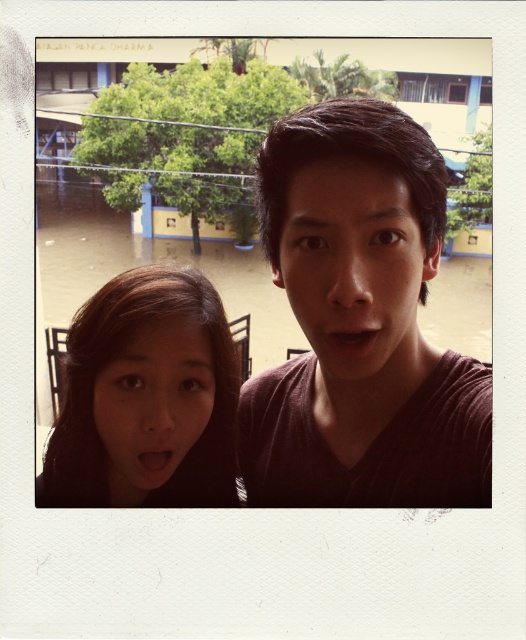
Between matte brown face at center and matte skin face at center, which one has more height?

matte brown face at center is taller.

Can you confirm if matte brown face at center is positioned above matte skin face at center?

Indeed, matte brown face at center is positioned over matte skin face at center.

Measure the distance between matte brown face at center and camera.

They are 22.04 inches apart.

Identify the location of matte brown face at center. (356, 275).

Does point (396, 403) come closer to viewer compared to point (108, 442)?

No.

Between point (332, 269) and point (116, 384), which one is positioned behind?

Point (116, 384)

I want to click on dark brown matte shirt at upper right, so click(x=359, y=324).

Can you confirm if brown hair at lower left is smaller than matte brown face at center?

No, brown hair at lower left is not smaller than matte brown face at center.

Find the location of a particular element. Image resolution: width=526 pixels, height=640 pixels. brown hair at lower left is located at coordinates point(146,397).

I want to click on brown hair at lower left, so click(146, 397).